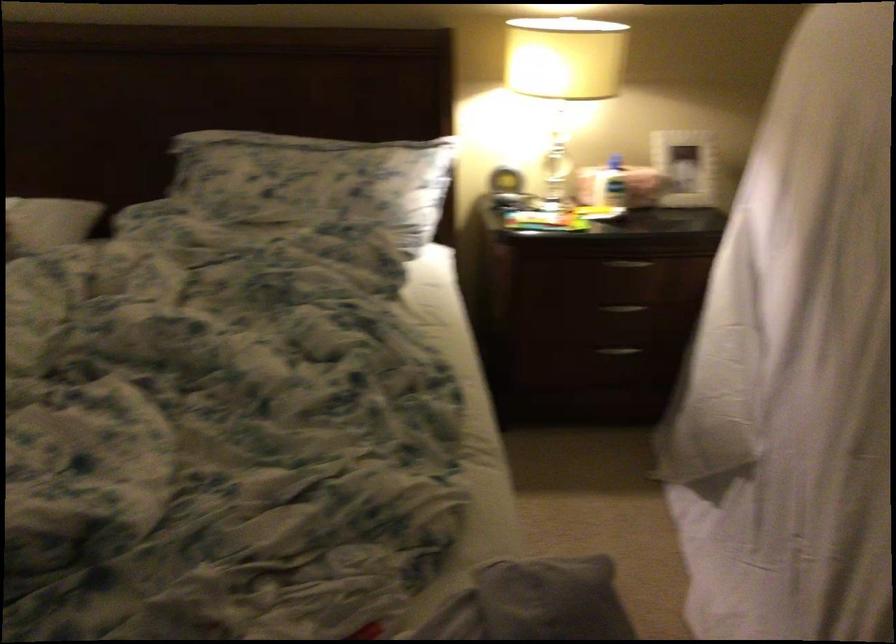
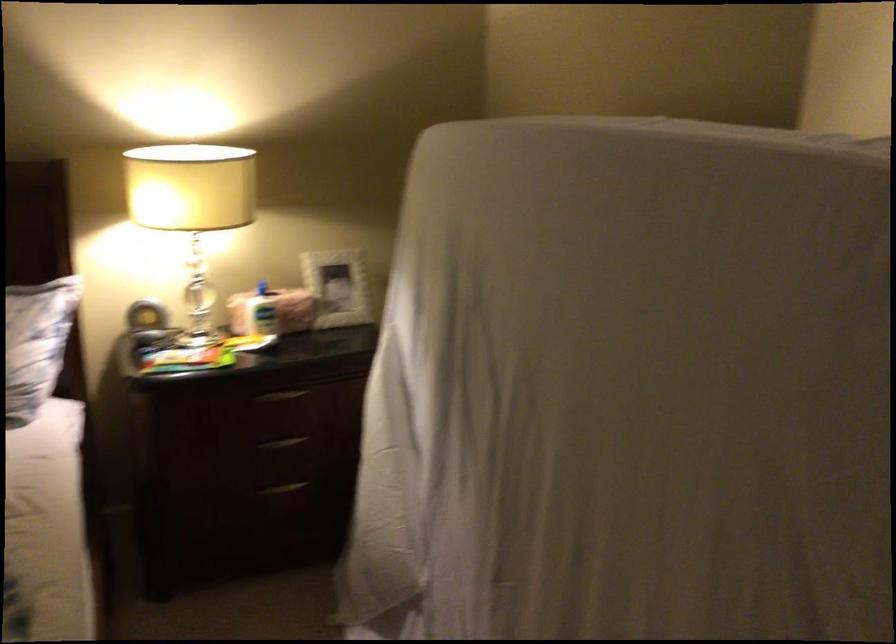
In the second image, find the point that corresponds to (617,156) in the first image.

(262, 288)